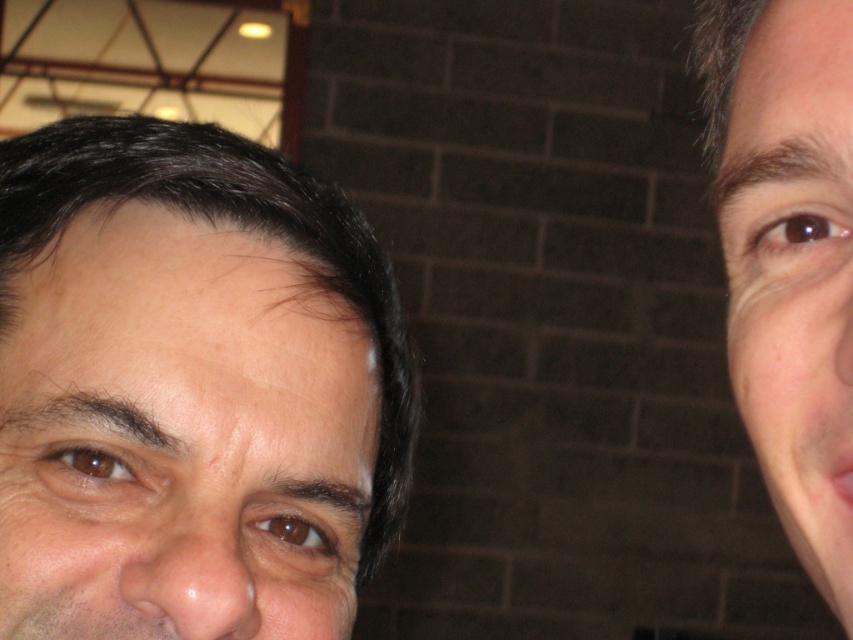
Consider the image. You are a photographer adjusting the camera focus. You need to ensure both the smooth skin face at left and the smooth skin face at right are in focus. Given that the depth of field can only sharply focus on one face, which face should you prioritize focusing on to maximize clarity?

The smooth skin face at left is bigger than the smooth skin face at right, so focusing on the smooth skin face at left would ensure it appears clearer in the photo.

You are a photographer adjusting the framing for a group photo. You need to ensure both smooth skin face at left and smooth skin face at right are centered within the camera frame. Given their face widths, which face requires more adjustment to center?

The smooth skin face at right requires more adjustment to center because its width is narrower than the smooth skin face at left, necessitating a larger positional shift to align both faces symmetrically.